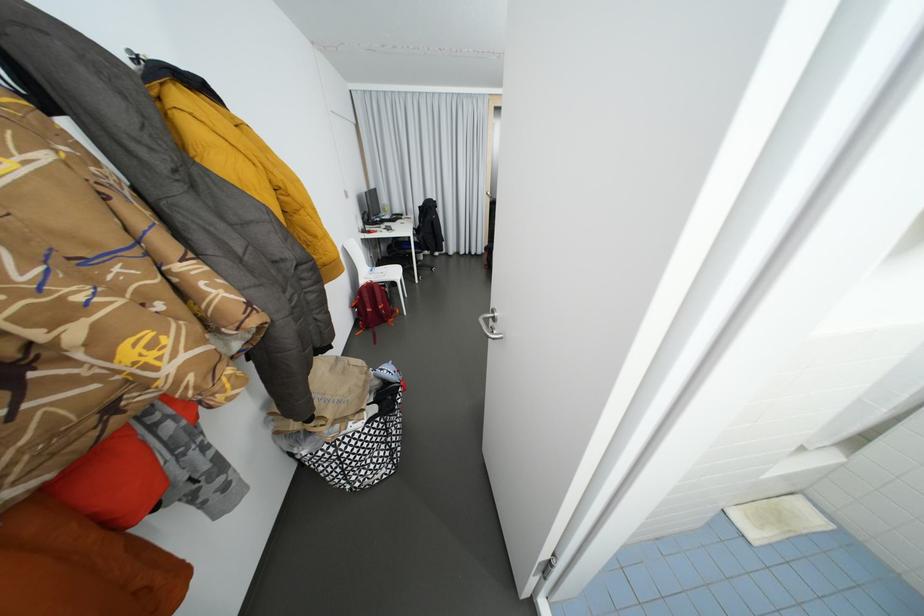
What do you see at coordinates (382, 272) in the screenshot? I see `a white chair sitting surface` at bounding box center [382, 272].